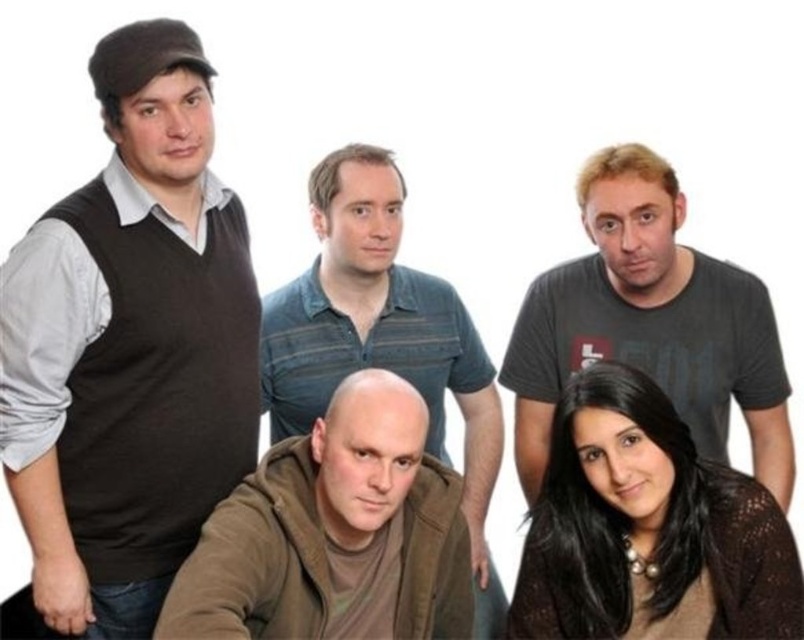
Based on the provided image description, what are the coordinates of the matte black sweater vest at left?

The coordinates of the matte black sweater vest at left are at point [129,348].